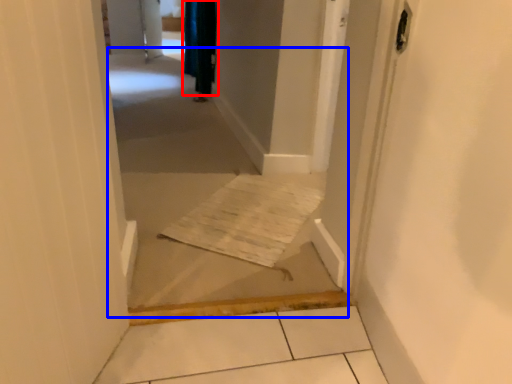
Question: Which object appears closest to the camera in this image, curtain (highlighted by a red box) or corridor (highlighted by a blue box)?

Choices:
 (A) curtain
 (B) corridor

Answer: (B)